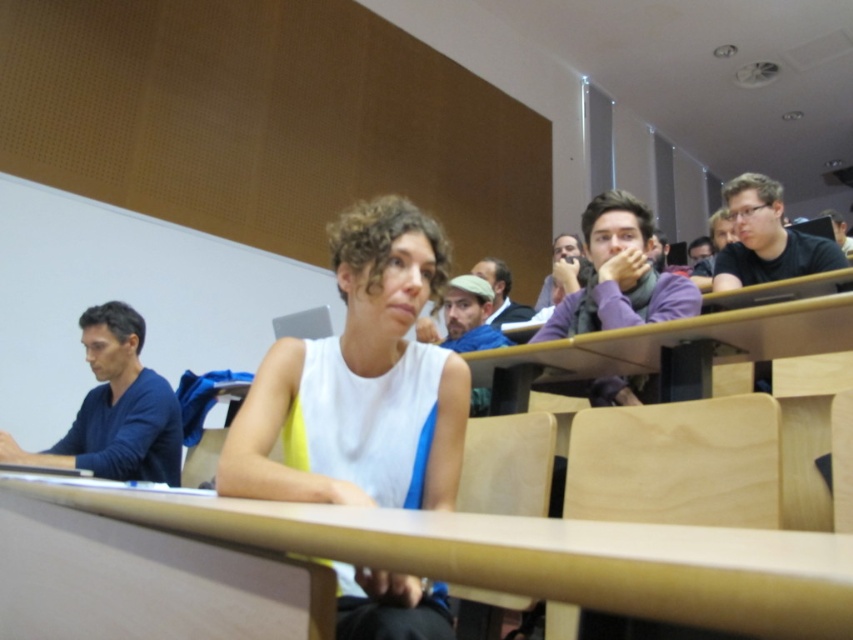
Question: Can you confirm if white matte tank top at center is smaller than wooden table at center?

Choices:
 (A) no
 (B) yes

Answer: (A)

Question: Which point is closer to the camera?

Choices:
 (A) tap(770, 586)
 (B) tap(260, 493)

Answer: (A)

Question: Which point is closer to the camera taking this photo?

Choices:
 (A) (457, 534)
 (B) (316, 440)

Answer: (A)

Question: From the image, what is the correct spatial relationship of white matte tank top at center in relation to wooden table at center?

Choices:
 (A) right
 (B) left

Answer: (A)

Question: Can you confirm if white matte tank top at center is positioned below wooden table at center?

Choices:
 (A) no
 (B) yes

Answer: (A)

Question: Which of the following is the farthest from the observer?

Choices:
 (A) (267, 445)
 (B) (717, 612)

Answer: (A)